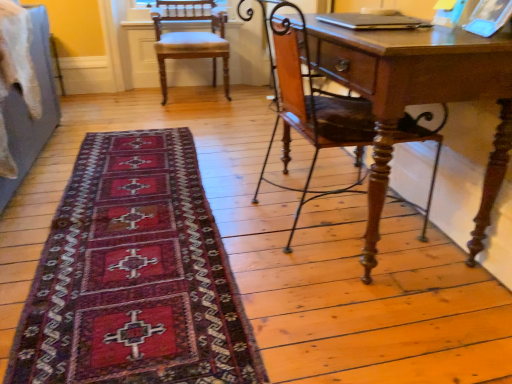
Measure the distance between dark red woven rug at lower left and camera.

dark red woven rug at lower left is 1.08 meters away from camera.

Image resolution: width=512 pixels, height=384 pixels. What do you see at coordinates (309, 103) in the screenshot?
I see `wooden chair at right, the 2th chair viewed from the back` at bounding box center [309, 103].

At what (x,y) coordinates should I click in order to perform the action: click on dark red woven rug at lower left. Please return your answer as a coordinate pair (x, y). The image size is (512, 384). Looking at the image, I should click on (134, 276).

Who is smaller, light brown wood chair at upper left, which appears as the 1th chair when viewed from the back, or dark red woven rug at lower left?

With smaller size is dark red woven rug at lower left.

Which object is positioned more to the left, light brown wood chair at upper left, placed as the 1th chair when sorted from top to bottom, or dark red woven rug at lower left?

light brown wood chair at upper left, placed as the 1th chair when sorted from top to bottom.

Where is `chair to the left of dark red woven rug at lower left`? chair to the left of dark red woven rug at lower left is located at coordinates (191, 37).

Is light brown wood chair at upper left, which appears as the second chair when viewed from the front, positioned with its back to dark red woven rug at lower left?

light brown wood chair at upper left, which appears as the second chair when viewed from the front, does not have its back to dark red woven rug at lower left.

Based on the photo, is dark red woven rug at lower left next to light brown wood chair at upper left, arranged as the 2th chair when viewed from the right?

There is a gap between dark red woven rug at lower left and light brown wood chair at upper left, arranged as the 2th chair when viewed from the right.

Is dark red woven rug at lower left thinner than light brown wood chair at upper left, which appears as the second chair when viewed from the front?

In fact, dark red woven rug at lower left might be wider than light brown wood chair at upper left, which appears as the second chair when viewed from the front.

Is dark red woven rug at lower left to the left of light brown wood chair at upper left, placed as the second chair when sorted from bottom to top, from the viewer's perspective?

No.

Who is taller, dark red woven rug at lower left or light brown wood chair at upper left, which appears as the second chair when viewed from the front?

light brown wood chair at upper left, which appears as the second chair when viewed from the front, is taller.

From a real-world perspective, is wooden chair at right, positioned as the 1th chair in bottom-to-top order, beneath dark red woven rug at lower left?

Incorrect, from a real-world perspective, wooden chair at right, positioned as the 1th chair in bottom-to-top order, is higher than dark red woven rug at lower left.

Would you consider wooden chair at right, positioned as the 1th chair in front-to-back order, to be distant from dark red woven rug at lower left?

That's not correct — wooden chair at right, positioned as the 1th chair in front-to-back order, is a little close to dark red woven rug at lower left.

From the image's perspective, which one is positioned higher, wooden chair at right, which is the second chair in top-to-bottom order, or dark red woven rug at lower left?

wooden chair at right, which is the second chair in top-to-bottom order.

Locate an element on the screen. Image resolution: width=512 pixels, height=384 pixels. chair on the right of dark red woven rug at lower left is located at coordinates (309, 103).

Is there a large distance between dark red woven rug at lower left and wooden chair at right, positioned as the 1th chair in front-to-back order?

No, dark red woven rug at lower left is not far away from wooden chair at right, positioned as the 1th chair in front-to-back order.

Could you tell me if dark red woven rug at lower left is turned towards wooden chair at right, the 2th chair viewed from the back?

No, dark red woven rug at lower left is not aimed at wooden chair at right, the 2th chair viewed from the back.

Can you confirm if dark red woven rug at lower left is shorter than wooden chair at right, which ranks as the 1th chair in right-to-left order?

Yes, dark red woven rug at lower left is shorter than wooden chair at right, which ranks as the 1th chair in right-to-left order.

Consider the image. Between dark red woven rug at lower left and wooden chair at right, which is the second chair in top-to-bottom order, which one is positioned in front?

dark red woven rug at lower left is more forward.

Considering the sizes of light brown wood chair at upper left, placed as the 1th chair when sorted from top to bottom, and wooden chair at right, which ranks as the 1th chair in right-to-left order, in the image, is light brown wood chair at upper left, placed as the 1th chair when sorted from top to bottom, wider or thinner than wooden chair at right, which ranks as the 1th chair in right-to-left order,?

Considering their sizes, light brown wood chair at upper left, placed as the 1th chair when sorted from top to bottom, looks slimmer than wooden chair at right, which ranks as the 1th chair in right-to-left order.

Is point (162, 54) closer to viewer compared to point (345, 131)?

No, (162, 54) is behind (345, 131).

Based on the photo, between light brown wood chair at upper left, placed as the 1th chair when sorted from top to bottom, and wooden chair at right, marked as the 2th chair in a left-to-right arrangement, which one appears on the left side from the viewer's perspective?

light brown wood chair at upper left, placed as the 1th chair when sorted from top to bottom, is more to the left.

Can light brown wood chair at upper left, which appears as the 1th chair when viewed from the back, be found inside wooden chair at right, which is the second chair in top-to-bottom order?

No.

Is point (295, 69) closer to viewer compared to point (186, 45)?

Yes, it is in front of point (186, 45).

Is wooden chair at right, positioned as the 1th chair in front-to-back order, closer to the viewer compared to light brown wood chair at upper left, arranged as the 2th chair when viewed from the right?

Yes.

Is wooden chair at right, the 2th chair viewed from the back, turned away from light brown wood chair at upper left, placed as the 1th chair when sorted from top to bottom?

wooden chair at right, the 2th chair viewed from the back, is not turned away from light brown wood chair at upper left, placed as the 1th chair when sorted from top to bottom.

Locate an element on the screen. The image size is (512, 384). the 2nd chair behind the dark red woven rug at lower left is located at coordinates [191, 37].

From the image's perspective, which chair is the 2nd one above the dark red woven rug at lower left? Please provide its 2D coordinates.

[(191, 37)]

Which object lies further to the anchor point dark red woven rug at lower left, light brown wood chair at upper left, placed as the 1th chair when sorted from top to bottom, or wooden chair at right, which ranks as the 1th chair in right-to-left order?

light brown wood chair at upper left, placed as the 1th chair when sorted from top to bottom.

Estimate the real-world distances between objects in this image. Which object is closer to light brown wood chair at upper left, which appears as the 1th chair when viewed from the back, wooden chair at right, marked as the 2th chair in a left-to-right arrangement, or dark red woven rug at lower left?

Based on the image, wooden chair at right, marked as the 2th chair in a left-to-right arrangement, appears to be nearer to light brown wood chair at upper left, which appears as the 1th chair when viewed from the back.

Considering their positions, is light brown wood chair at upper left, which appears as the 1th chair when viewed from the back, positioned closer to wooden chair at right, positioned as the 1th chair in bottom-to-top order, than dark red woven rug at lower left?

dark red woven rug at lower left is positioned closer to the anchor wooden chair at right, positioned as the 1th chair in bottom-to-top order.

Looking at the image, which one is located closer to wooden chair at right, which is the second chair in top-to-bottom order, dark red woven rug at lower left or light brown wood chair at upper left, placed as the second chair when sorted from bottom to top?

The object closer to wooden chair at right, which is the second chair in top-to-bottom order, is dark red woven rug at lower left.

Considering their positions, is dark red woven rug at lower left positioned closer to light brown wood chair at upper left, arranged as the 2th chair when viewed from the right, than wooden chair at right, which ranks as the 1th chair in right-to-left order?

wooden chair at right, which ranks as the 1th chair in right-to-left order.

Considering their positions, is wooden chair at right, marked as the 2th chair in a left-to-right arrangement, positioned closer to dark red woven rug at lower left than light brown wood chair at upper left, arranged as the 2th chair when viewed from the right?

Based on the image, wooden chair at right, marked as the 2th chair in a left-to-right arrangement, appears to be nearer to dark red woven rug at lower left.

You are a GUI agent. You are given a task and a screenshot of the screen. Output one action in this format:
    pyautogui.click(x=<x>, y=<y>)
    Task: Click on the chair positioned between dark red woven rug at lower left and light brown wood chair at upper left, placed as the second chair when sorted from bottom to top, from near to far
    
    Given the screenshot: What is the action you would take?
    pyautogui.click(x=309, y=103)